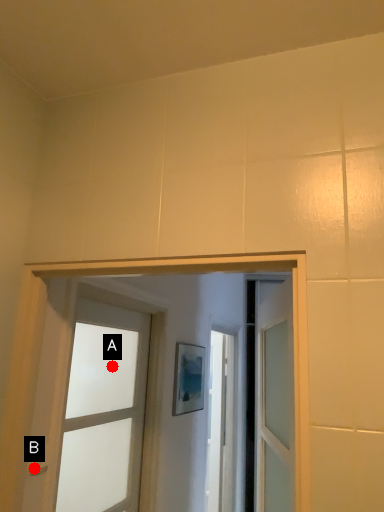
Question: Two points are circled on the image, labeled by A and B beside each circle. Which point is farther from the camera taking this photo?

Choices:
 (A) A is further
 (B) B is further

Answer: (A)